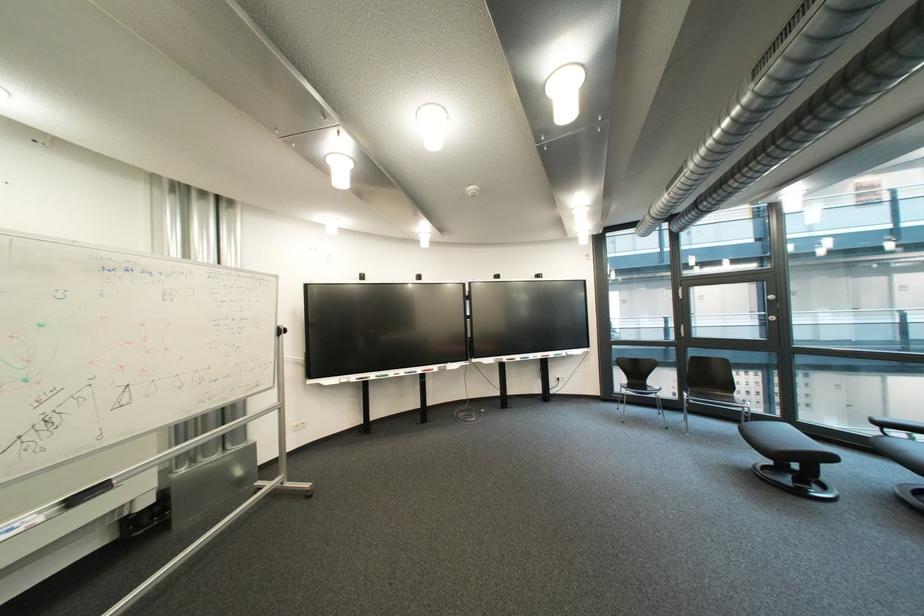
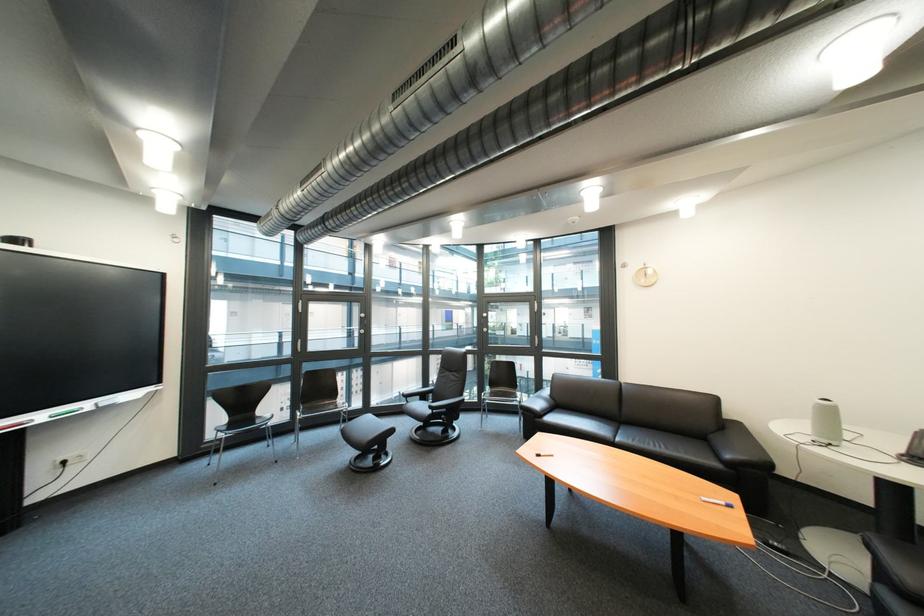
In the second image, find the point that corresponds to pixel 577 354 in the first image.

(101, 406)